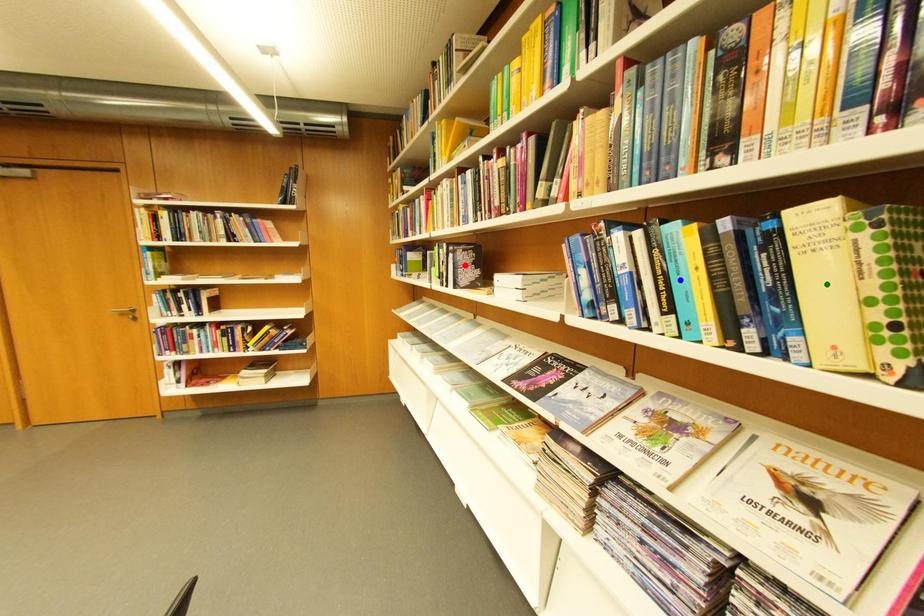
Order these from nearest to farthest:
blue point
red point
green point

red point → blue point → green point